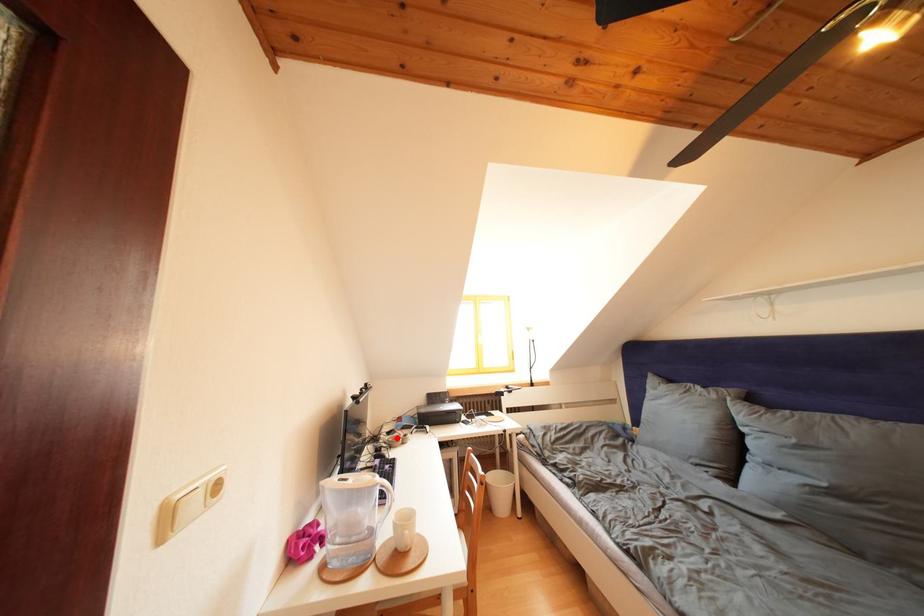
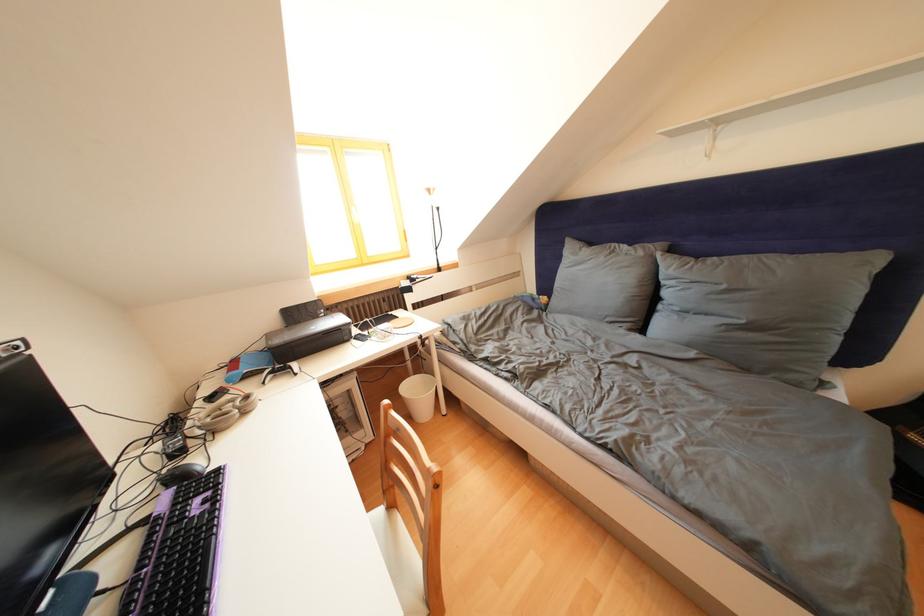
In the second image, find the point that corresponds to the highlighted location in the first image.

(220, 403)